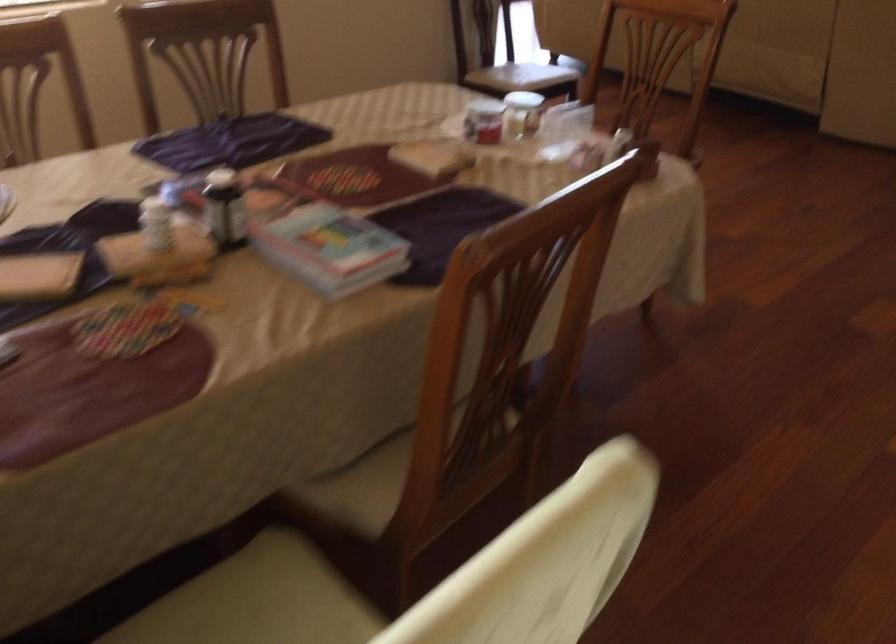
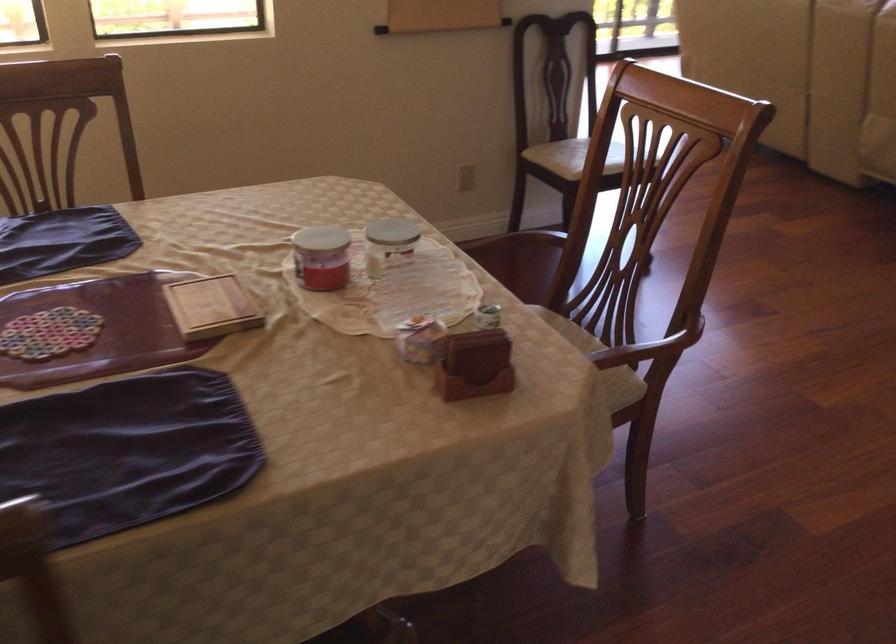
The point at (523, 108) is marked in the first image. Where is the corresponding point in the second image?

(389, 243)